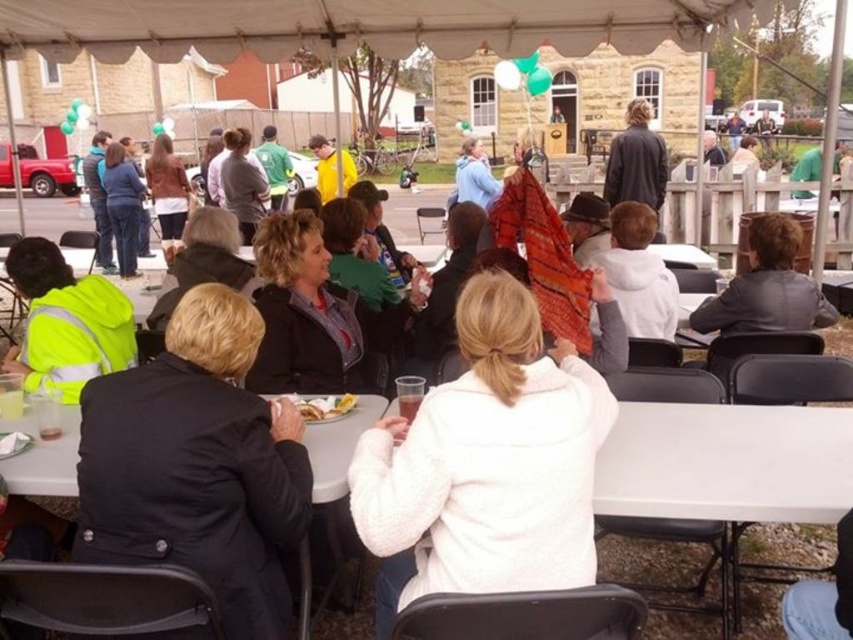
You are organizing a community event and need to seat two people next to each other at a table. You have a black matte jacket at lower left and a high visibility yellow jacket at lower left. Which jacket takes up more space on the table?

The high visibility yellow jacket at lower left takes up more space on the table because its width is greater than the black matte jacket at lower left.